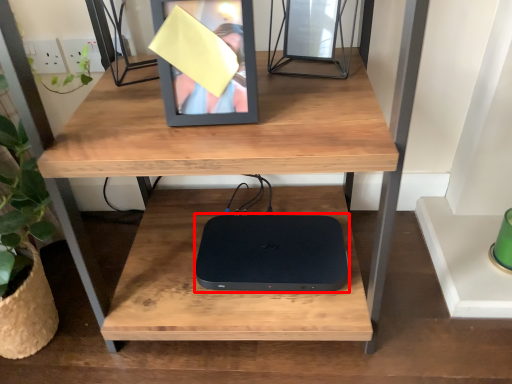
Question: From the image's perspective, where is computer (annotated by the red box) located relative to picture frame?

Choices:
 (A) above
 (B) below

Answer: (B)